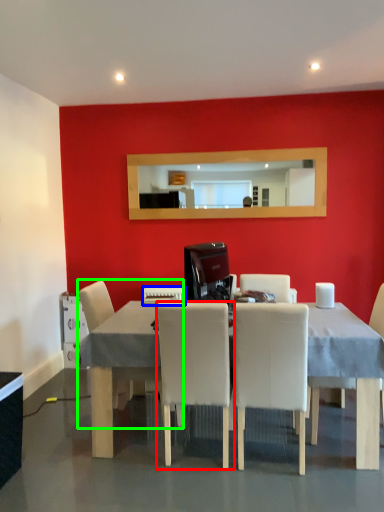
Question: Considering the real-world distances, which object is farthest from chair (highlighted by a red box)? appliance (highlighted by a blue box) or chair (highlighted by a green box)?

Choices:
 (A) appliance
 (B) chair

Answer: (A)